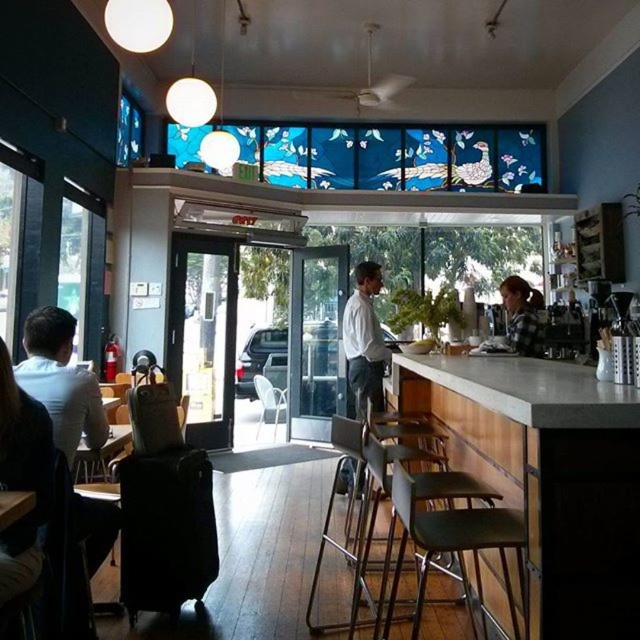
You are a customer entering the modern cafe and want to order a drink. The smooth concrete bar at center and the white shirt at center are both in your view. Which object should you approach to place your order?

You should approach the smooth concrete bar at center to place your order because it is larger in size than the white shirt at center and likely serves as the main counter for ordering.